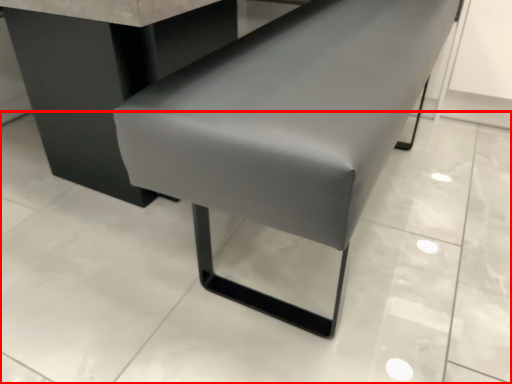
Question: From the image's perspective, what is the correct spatial positioning of concrete (annotated by the red box) in reference to furniture?

Choices:
 (A) below
 (B) above

Answer: (B)